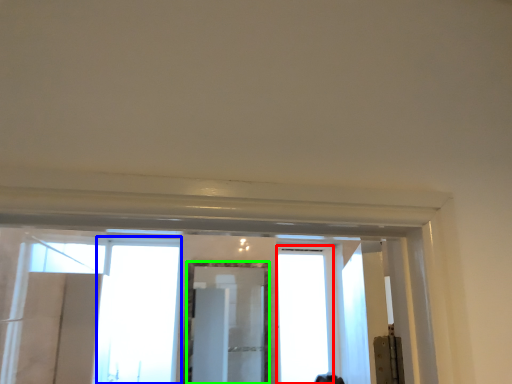
Question: Based on their relative distances, which object is nearer to window (highlighted by a red box)? Choose from window (highlighted by a blue box) and mirror (highlighted by a green box).

Choices:
 (A) window
 (B) mirror

Answer: (B)